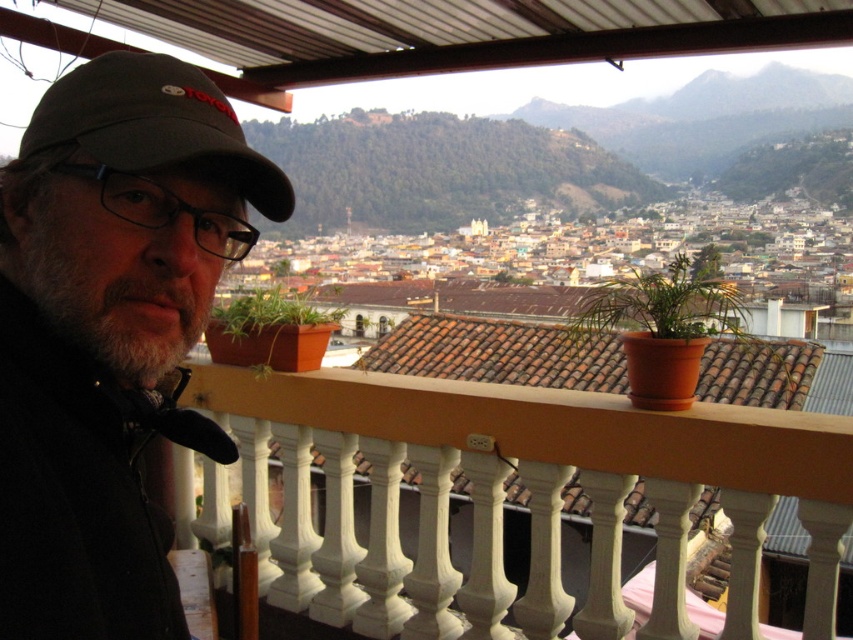
Question: Is terracotta clay pot at center positioned in front of green matte plant at center?

Choices:
 (A) no
 (B) yes

Answer: (B)

Question: Which object is closer to the camera taking this photo?

Choices:
 (A) green matte plant at center
 (B) dark gray fabric cap at upper left

Answer: (B)

Question: Which object appears closest to the camera in this image?

Choices:
 (A) terracotta clay pot at center
 (B) black matte cap at upper left

Answer: (B)

Question: Does white painted wood balustrade at center appear on the left side of dark gray fabric cap at upper left?

Choices:
 (A) no
 (B) yes

Answer: (A)

Question: Which of the following is the farthest from the observer?

Choices:
 (A) (656, 358)
 (B) (206, 154)
 (C) (293, 320)

Answer: (C)

Question: Is white painted wood balustrade at center to the right of black matte cap at upper left from the viewer's perspective?

Choices:
 (A) no
 (B) yes

Answer: (B)